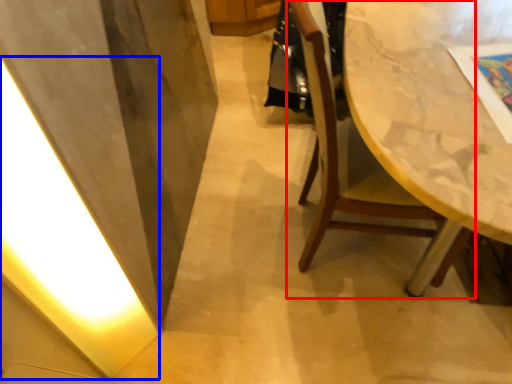
Question: Which of the following is the farthest to the observer, chair (highlighted by a red box) or light (highlighted by a blue box)?

Choices:
 (A) chair
 (B) light

Answer: (A)